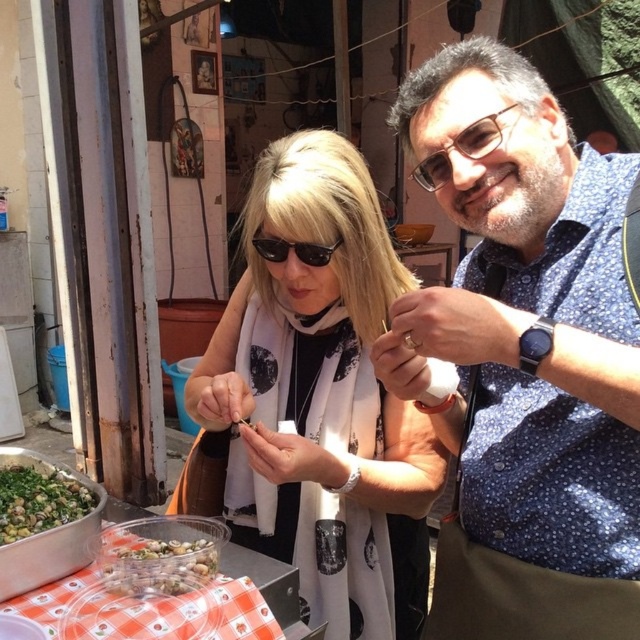
You are a delivery person who needs to pack the clear plastic container at lower left and the black plastic sunglasses at center into a box. The box can only hold items that are no larger than the sunglasses. Can both items fit?

The clear plastic container at lower left is larger than the black plastic sunglasses at center, so it cannot fit into the box if the box can only hold items no larger than the sunglasses. Only the sunglasses can fit.

You are a delivery person who needs to place a package between the matte black glasses at upper center and the black plastic sunglasses at center. The package is 25 centimeters long. Can you fit it between them without moving the glasses or sunglasses?

The distance between the matte black glasses at upper center and the black plastic sunglasses at center is 23.40 centimeters. Since the package is 25 centimeters long, which is longer than the available space, it cannot be placed between them without moving the objects.

You are a customer at a sunglasses store and see the matte black glasses at upper center and the black plastic sunglasses at center. Which pair is bigger?

The matte black glasses at upper center is larger in size than the black plastic sunglasses at center.